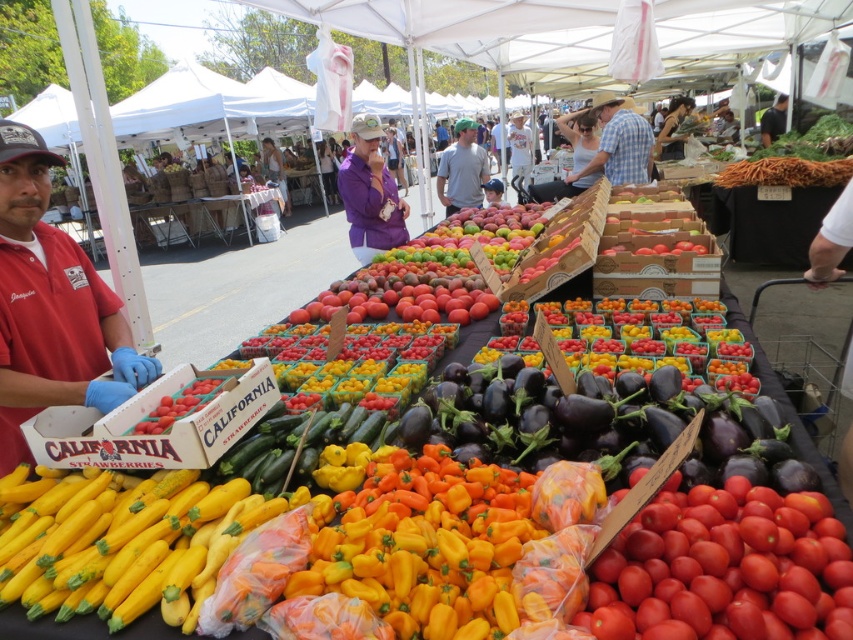
Question: Can you confirm if red matte tomatoes at lower right is positioned below checkered fabric shirt at center?

Choices:
 (A) no
 (B) yes

Answer: (B)

Question: Among these objects, which one is nearest to the camera?

Choices:
 (A) checkered fabric shirt at center
 (B) red matte tomatoes at lower right

Answer: (B)

Question: From the image, what is the correct spatial relationship of purple fabric shirt at center in relation to gray cotton shirt at center?

Choices:
 (A) left
 (B) right

Answer: (A)

Question: Which of the following is the farthest from the observer?

Choices:
 (A) (381, 157)
 (B) (608, 161)

Answer: (B)

Question: Which point appears farthest from the camera in this image?

Choices:
 (A) (451, 212)
 (B) (635, 113)
 (C) (372, 198)
 (D) (822, 564)

Answer: (A)

Question: Considering the relative positions of checkered fabric shirt at center and gray cotton shirt at center in the image provided, where is checkered fabric shirt at center located with respect to gray cotton shirt at center?

Choices:
 (A) below
 (B) above

Answer: (A)